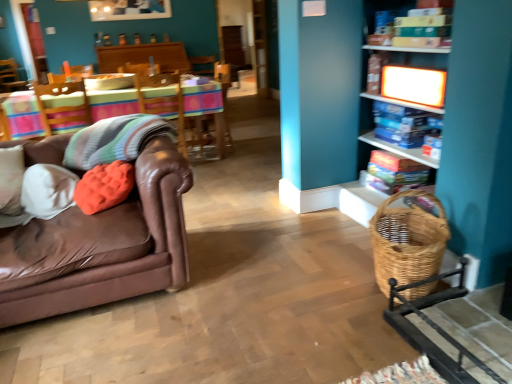
You are a GUI agent. You are given a task and a screenshot of the screen. Output one action in this format:
    pyautogui.click(x=<x>, y=<y>)
    Task: Click on the spots to the right of brown leather couch at left
    The width and height of the screenshot is (512, 384).
    Given the screenshot: What is the action you would take?
    pyautogui.click(x=264, y=288)